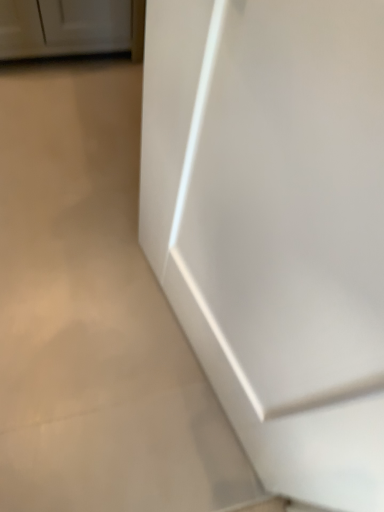
Question: Should I look upward or downward to see white smooth concrete at lower right?

Choices:
 (A) up
 (B) down

Answer: (A)